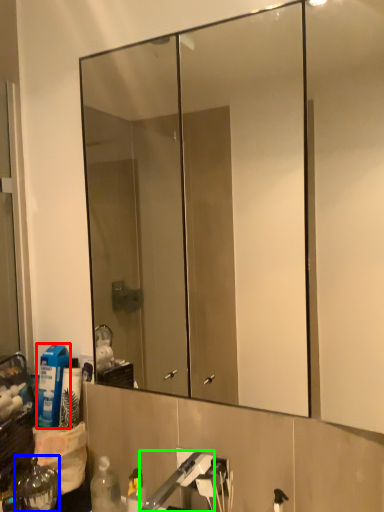
Question: Based on their relative distances, which object is farther from cleaning product (highlighted by a red box)? Choose from bottle (highlighted by a blue box) and faucet (highlighted by a green box).

Choices:
 (A) bottle
 (B) faucet

Answer: (B)